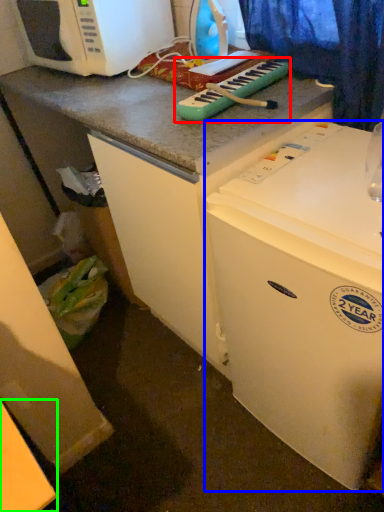
Question: Based on their relative distances, which object is farther from musical keyboard (highlighted by a red box)? Choose from refrigerator (highlighted by a blue box) and counter top (highlighted by a green box).

Choices:
 (A) refrigerator
 (B) counter top

Answer: (B)